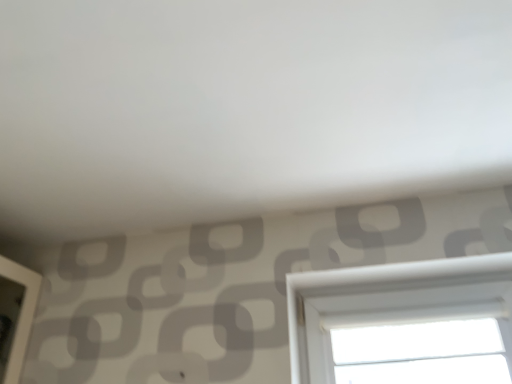
Measure the distance between point (335,344) and camera.

Point (335,344) is 1.43 meters away from camera.

Where is `white plastic window screen at lower right`? Image resolution: width=512 pixels, height=384 pixels. white plastic window screen at lower right is located at coordinates (421, 353).

The width and height of the screenshot is (512, 384). What do you see at coordinates (421, 353) in the screenshot? I see `white plastic window screen at lower right` at bounding box center [421, 353].

Locate an element on the screen. The image size is (512, 384). white plastic window screen at lower right is located at coordinates click(x=421, y=353).